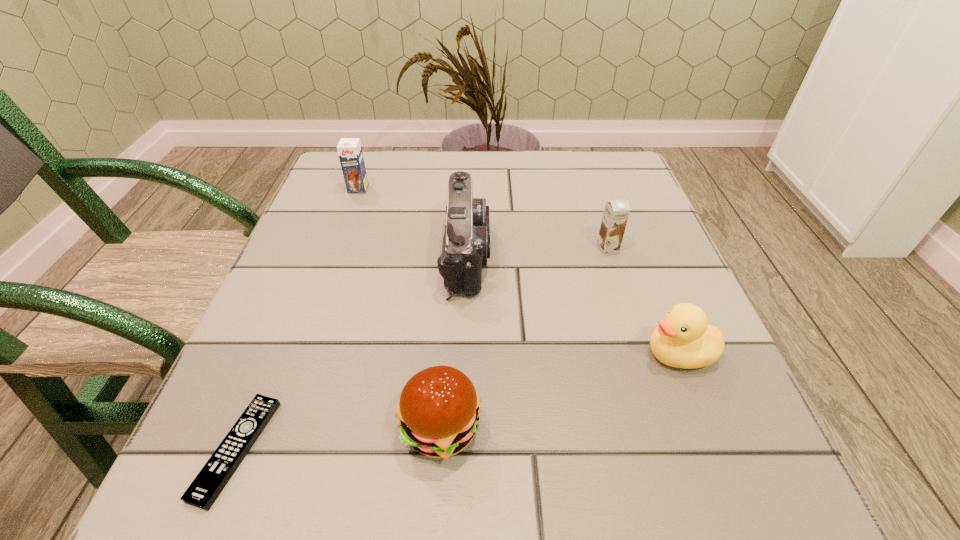
I want to click on chocolate milk situated at the right edge, so click(x=616, y=212).

Locate an element on the screen. duckling that is at the right edge is located at coordinates coord(683,339).

You are a GUI agent. You are given a task and a screenshot of the screen. Output one action in this format:
    pyautogui.click(x=<x>, y=<y>)
    Task: Click on the object present at the far left corner
    
    Given the screenshot: What is the action you would take?
    pyautogui.click(x=349, y=150)

Locate an element on the screen. The width and height of the screenshot is (960, 540). object positioned at the near left corner is located at coordinates (206, 487).

Identify the location of vacant space at the far edge. This screenshot has width=960, height=540. click(396, 164).

In the image, there is a desktop. Identify the location of vacant space at the near edge. click(x=496, y=497).

At what (x,y) coordinates should I click in order to perform the action: click on free region at the left edge of the desktop. Please return your answer as a coordinate pair (x, y). The height and width of the screenshot is (540, 960). Looking at the image, I should click on tap(319, 219).

This screenshot has height=540, width=960. In the image, there is a desktop. Identify the location of vacant area at the right edge. (738, 441).

What are the coordinates of `vacant space at the far left corner of the desktop` in the screenshot? It's located at (324, 178).

This screenshot has height=540, width=960. Find the location of `vacant space at the far right corner`. vacant space at the far right corner is located at coordinates (588, 167).